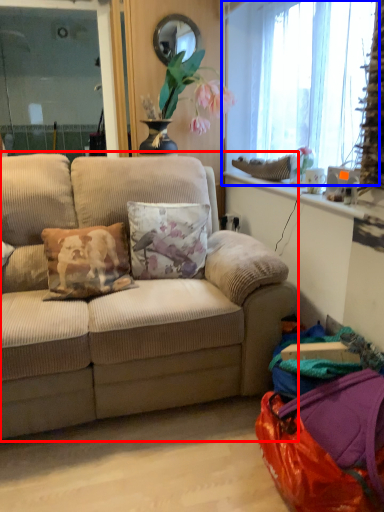
Question: Which of the following is the closest to the observer, studio couch (highlighted by a red box) or window (highlighted by a blue box)?

Choices:
 (A) studio couch
 (B) window

Answer: (A)